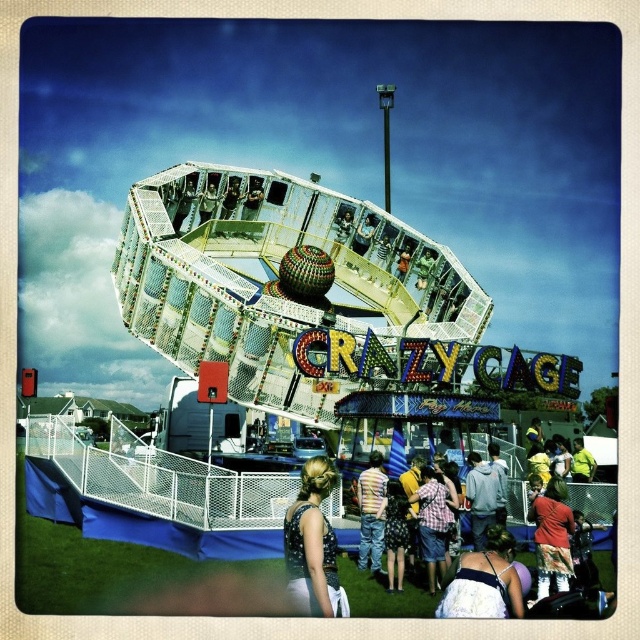
Question: Is floral-patterned dress at center to the right of plaid shirt at center from the viewer's perspective?

Choices:
 (A) yes
 (B) no

Answer: (A)

Question: Based on their relative distances, which object is nearer to the matte gray hoodie at center?

Choices:
 (A) floral-patterned dress at center
 (B) striped shirt at center
 (C) white lace dress at center
 (D) dark blue textured dress at center

Answer: (A)

Question: Which of these objects is positioned farthest from the dark blue textured dress at center?

Choices:
 (A) floral-patterned dress at center
 (B) white lace dress at center

Answer: (A)

Question: Is white lace dress at center positioned before plaid shirt at center?

Choices:
 (A) no
 (B) yes

Answer: (B)

Question: Which point appears farthest from the camera in this image?

Choices:
 (A) (432, 518)
 (B) (483, 541)

Answer: (B)

Question: Is metallic shiny cage at center to the left of dark blue textured dress at center from the viewer's perspective?

Choices:
 (A) no
 (B) yes

Answer: (B)